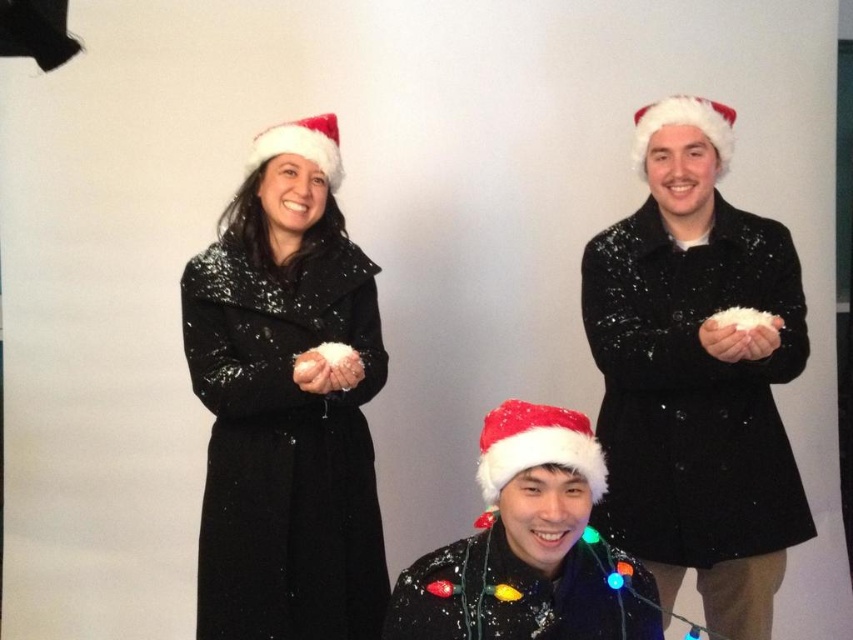
Looking at this image, you are a photographer setting up for a holiday photo shoot. You want to ensure that the glossy sequined coat at center and the red felt santa hat at upper left are both visible in the frame. Based on their positions, which object should you adjust to be more to the right to include both in the shot?

The glossy sequined coat at center is positioned on the left side of red felt santa hat at upper left. To include both in the shot, you should adjust the glossy sequined coat at center to move it more to the right so it doesn

You are standing in front of this festive scene and want to know which of the two points, point (210, 609) or point (310, 161), is nearer to you. Can you determine this based on their positions?

Point (210, 609) is closer to the viewer than point (310, 161), so the first point is nearer to you.

You are organizing a holiday photo shoot and need to ensure that the glossy sequined coat at center and the red felt santa hat at upper left are visible in the final shot. Given their sizes, which object should you focus on to ensure both are in frame?

The glossy sequined coat at center is bigger than the red felt santa hat at upper left, so focusing on the glossy sequined coat at center will ensure both are visible in the frame since it takes up more space.